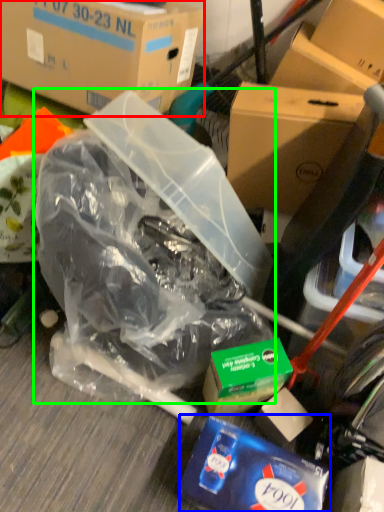
Question: Which object is positioned closest to box (highlighted by a red box)? Select from waste (highlighted by a blue box) and plastic bag (highlighted by a green box).

Choices:
 (A) waste
 (B) plastic bag

Answer: (B)